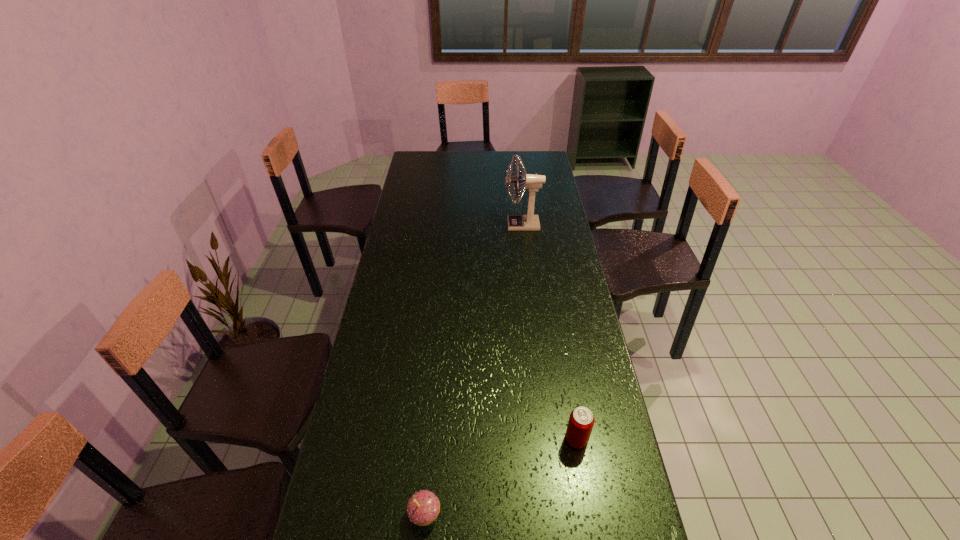
Locate an element on the screen. The width and height of the screenshot is (960, 540). the tallest object is located at coordinates pos(530,222).

This screenshot has height=540, width=960. Identify the location of the farthest object. (530, 222).

In order to click on can in this screenshot , I will do `click(581, 421)`.

Where is `the nearest object`? The width and height of the screenshot is (960, 540). the nearest object is located at coordinates (423, 507).

Where is `the leftmost object`? The width and height of the screenshot is (960, 540). the leftmost object is located at coordinates (423, 507).

The width and height of the screenshot is (960, 540). I want to click on vacant space located 0.150m on the front-facing side of the farthest object, so 470,225.

In order to click on blank space located on the front-facing side of the farthest object in this screenshot , I will do `click(484, 225)`.

The height and width of the screenshot is (540, 960). In order to click on vacant space positioned on the front-facing side of the farthest object in this screenshot , I will do `click(455, 225)`.

You are a GUI agent. You are given a task and a screenshot of the screen. Output one action in this format:
    pyautogui.click(x=<x>, y=<y>)
    Task: Click on the vacant space positioned on the back of the can
    The image size is (960, 540).
    Given the screenshot: What is the action you would take?
    [565, 373]

The height and width of the screenshot is (540, 960). In order to click on vacant position located on the right of the leftmost object in this screenshot , I will do `click(469, 514)`.